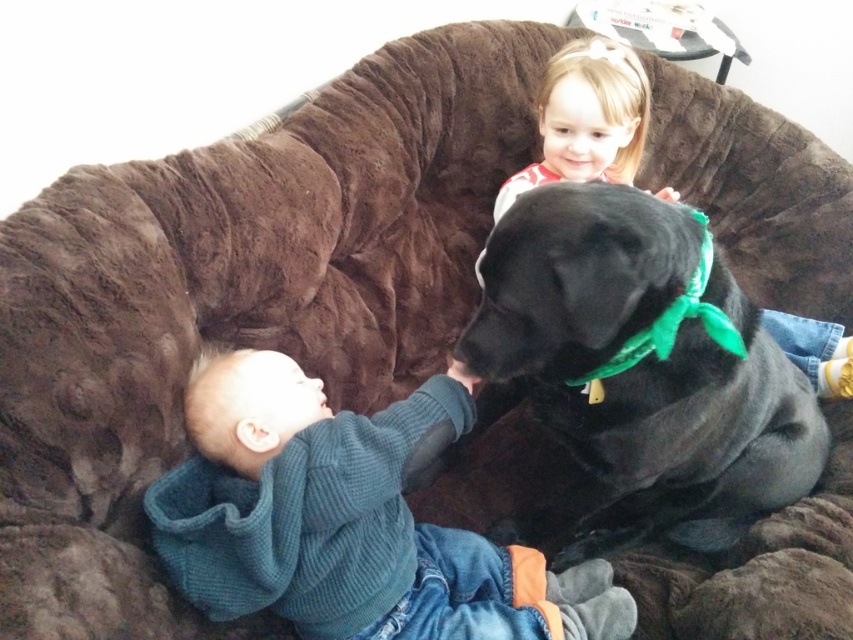
You are a photographer setting up a shoot in this living room. You need to position a light source to illuminate both the knitted teal sweater at lower left and the blonde hair at upper right. Based on their positions, where should you place the light source to ensure both areas are well lit?

The knitted teal sweater at lower left is located below blonde hair at upper right, so placing the light source above and to the right would effectively illuminate both areas.